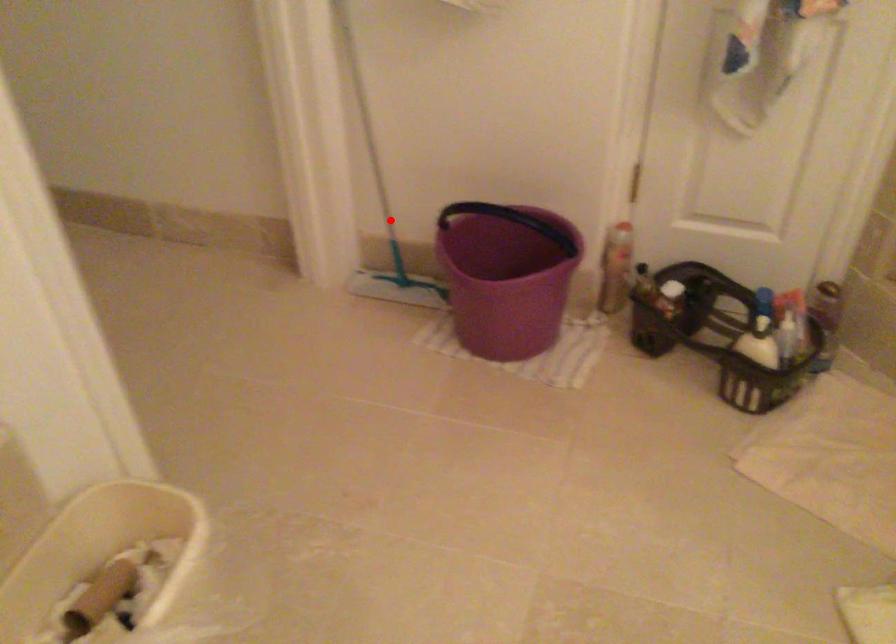
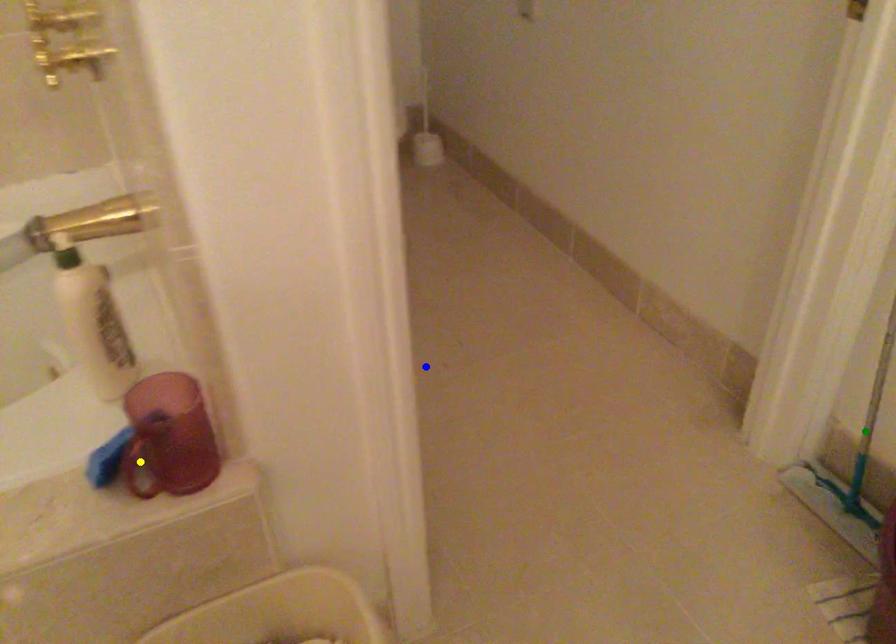
Question: I am providing you with two images of the same scene from different viewpoints. A red point is marked on the first image. You are given multiple points on the second image. In image 2, which mark is for the same physical point as the one in image 1?

Choices:
 (A) yellow point
 (B) green point
 (C) blue point

Answer: (B)